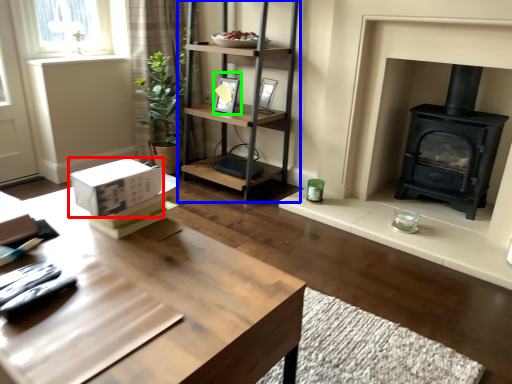
Question: Which is nearer to the cardboard box (highlighted by a red box)? shelf (highlighted by a blue box) or picture frame (highlighted by a green box).

Choices:
 (A) shelf
 (B) picture frame

Answer: (A)